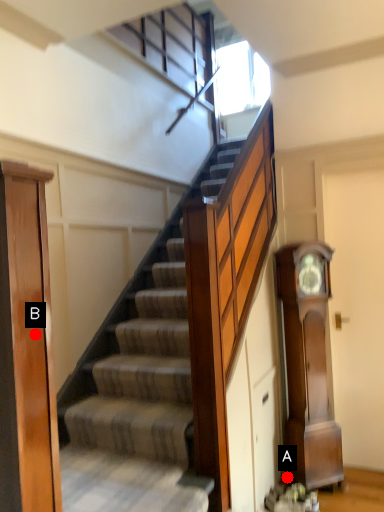
Question: Two points are circled on the image, labeled by A and B beside each circle. Which point is closer to the camera taking this photo?

Choices:
 (A) A is closer
 (B) B is closer

Answer: (B)